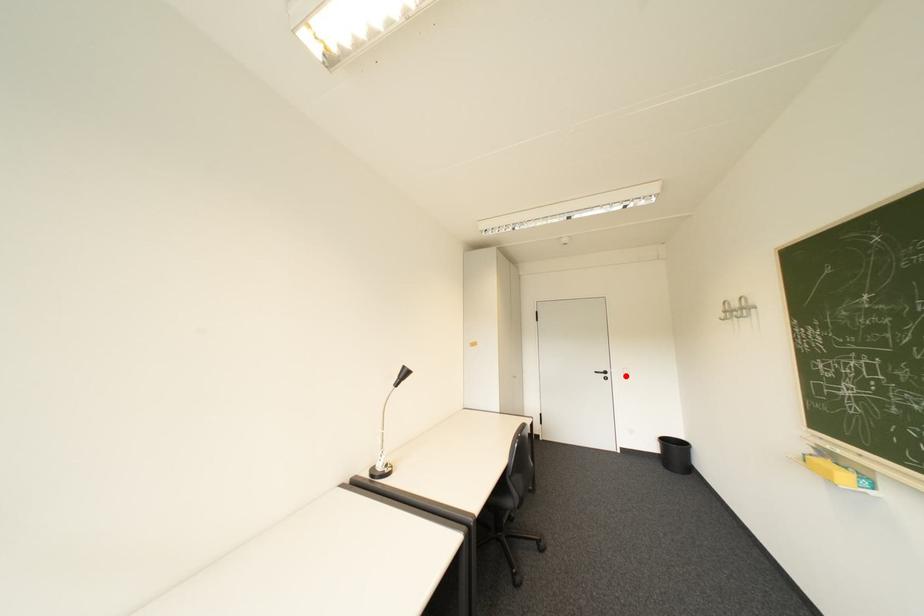
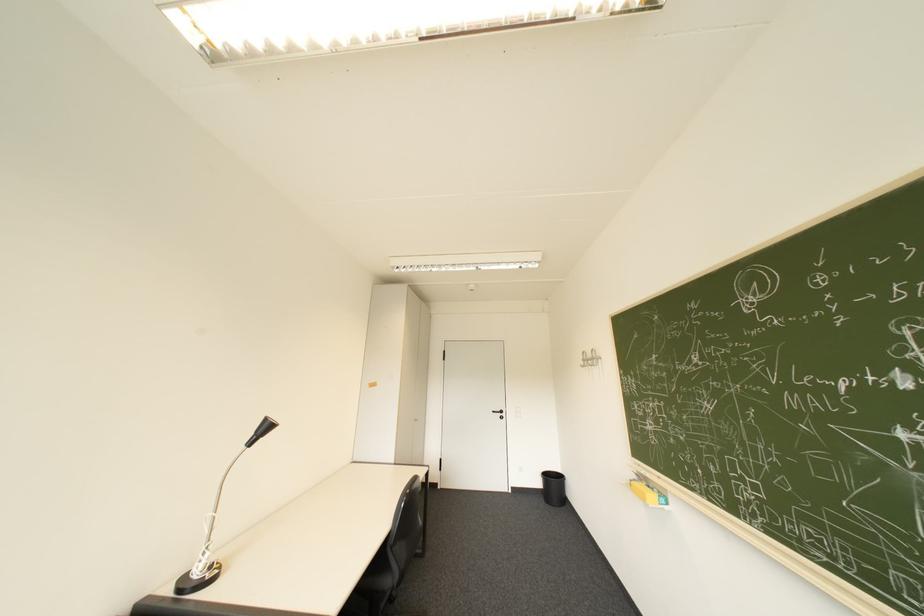
In the second image, find the point that corresponds to the highlighted location in the first image.

(519, 415)